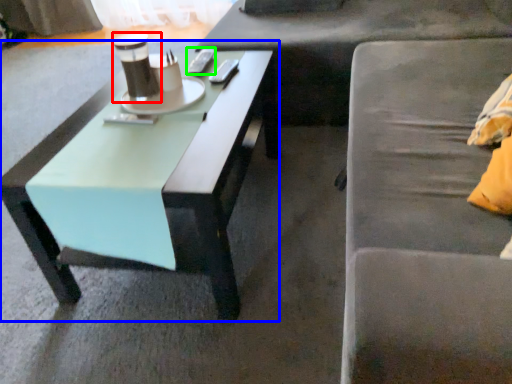
Question: Considering the real-world distances, which object is farthest from coffee cup (highlighted by a red box)? coffee table (highlighted by a blue box) or remote control (highlighted by a green box)?

Choices:
 (A) coffee table
 (B) remote control

Answer: (A)